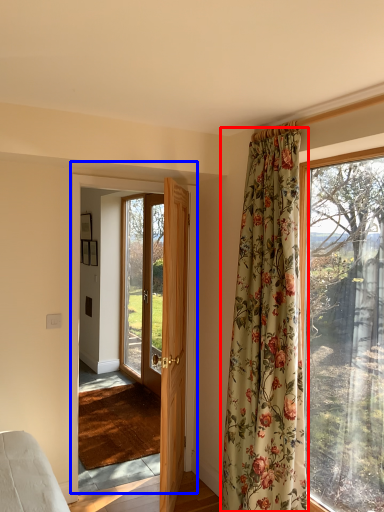
Question: Which object is closer to the camera taking this photo, curtain (highlighted by a red box) or door (highlighted by a blue box)?

Choices:
 (A) curtain
 (B) door

Answer: (A)